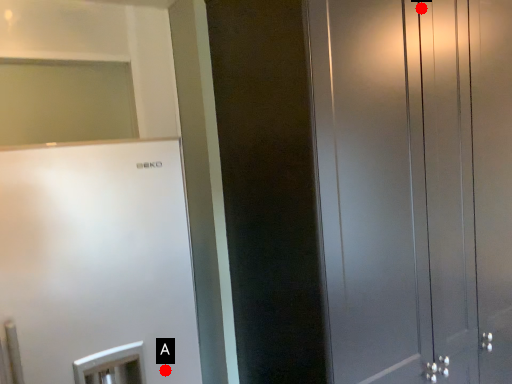
Question: Two points are circled on the image, labeled by A and B beside each circle. Which point is farther to the camera?

Choices:
 (A) A is further
 (B) B is further

Answer: (B)